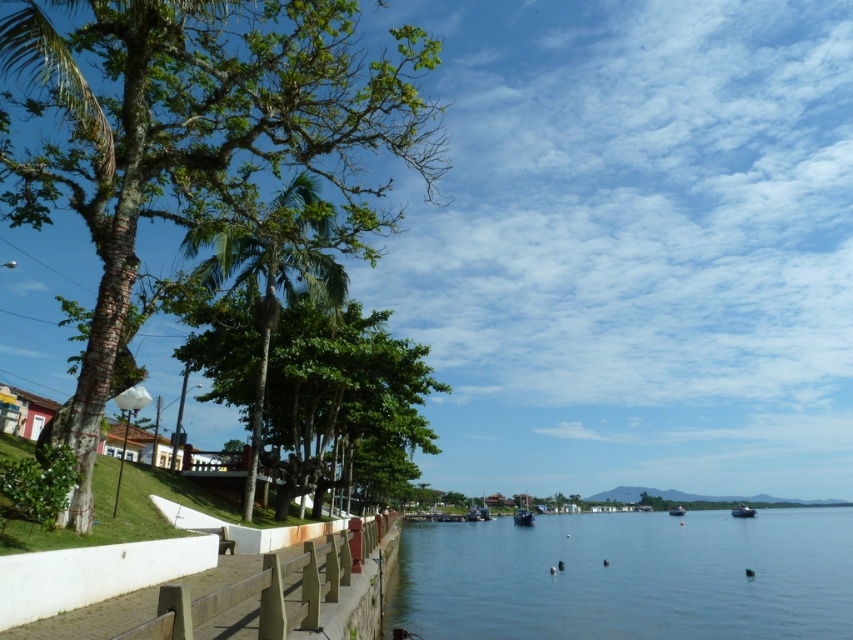
You are a painter setting up an easel to paint the waterfront scene. You want to ensure both the green leafy tree at center and the dark blue plastic boat at center are fully visible in your painting. Which object should you position closer to the edge of your canvas to avoid overcrowding?

Since the green leafy tree at center might be wider than the dark blue plastic boat at center, you should position the dark blue plastic boat at center closer to the edge of your canvas to accommodate the wider tree and prevent overcrowding.

You are a painter setting up your easel on the pathway near the smooth bark tree at left. You want to paint the dark blue plastic boat at center without moving your easel. Will the tree block your view of the boat?

The smooth bark tree at left has a greater height compared to the dark blue plastic boat at center, so the tree may block part of the view of the boat depending on the angle and distance between them.